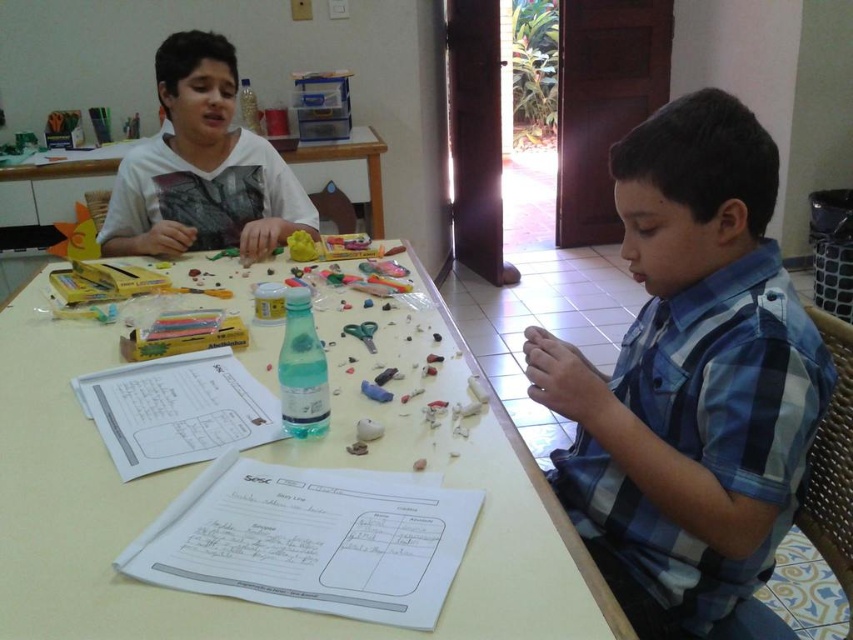
Is white plastic table at center to the right of white matte shirt at upper left from the viewer's perspective?

Yes, white plastic table at center is to the right of white matte shirt at upper left.

Who is higher up, white plastic table at center or white matte shirt at upper left?

white matte shirt at upper left is above.

Where is `white plastic table at center`? The image size is (853, 640). white plastic table at center is located at coordinates (271, 461).

Who is more distant from viewer, (x=236, y=240) or (x=294, y=160)?

The point (x=294, y=160) is more distant.

What do you see at coordinates (202, 168) in the screenshot? I see `white matte shirt at upper left` at bounding box center [202, 168].

Is point (175, 211) farther from viewer compared to point (357, 141)?

No, it is in front of (357, 141).

At what (x,y) coordinates should I click in order to perform the action: click on white matte shirt at upper left. Please return your answer as a coordinate pair (x, y). Image resolution: width=853 pixels, height=640 pixels. Looking at the image, I should click on coord(202,168).

From the picture: Does blue plaid shirt at right have a lesser height compared to white plastic table at upper left?

In fact, blue plaid shirt at right may be taller than white plastic table at upper left.

Does blue plaid shirt at right have a smaller size compared to white plastic table at upper left?

Yes.

Is point (637, 200) positioned after point (376, 160)?

No, (637, 200) is in front of (376, 160).

I want to click on blue plaid shirt at right, so click(x=691, y=381).